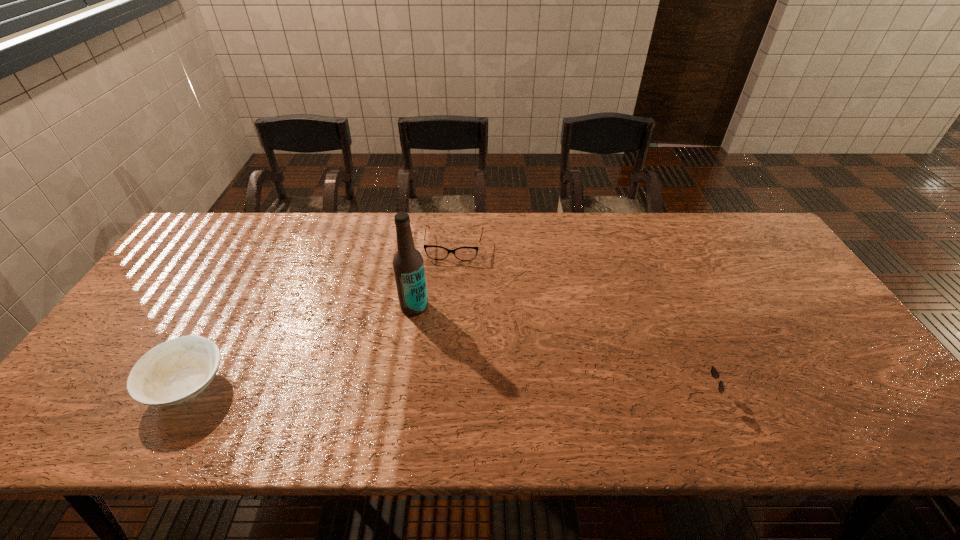
You are a GUI agent. You are given a task and a screenshot of the screen. Output one action in this format:
    pyautogui.click(x=<x>, y=<y>)
    Task: Click on the free space between the tallest object and the sunglasses
    The image size is (960, 540).
    Given the screenshot: What is the action you would take?
    pyautogui.click(x=555, y=350)

Where is `free space between the second farthest object and the rightmost object`? This screenshot has height=540, width=960. free space between the second farthest object and the rightmost object is located at coordinates (555, 350).

At what (x,y) coordinates should I click in order to perform the action: click on vacant space that's between the leftmost object and the farthest object. Please return your answer as a coordinate pair (x, y). The width and height of the screenshot is (960, 540). Looking at the image, I should click on (322, 316).

Where is `vacant point located between the tallest object and the bowl`? This screenshot has width=960, height=540. vacant point located between the tallest object and the bowl is located at coordinates (301, 346).

Identify the location of vacant area that lies between the shortest object and the rightmost object. This screenshot has width=960, height=540. (575, 321).

Find the location of a particular element. This screenshot has width=960, height=540. unoccupied area between the rightmost object and the tallest object is located at coordinates (555, 350).

This screenshot has height=540, width=960. I want to click on free point between the tallest object and the bowl, so click(x=301, y=346).

This screenshot has height=540, width=960. Find the location of `free space that is in between the tallest object and the leftmost object`. free space that is in between the tallest object and the leftmost object is located at coordinates (301, 346).

You are a GUI agent. You are given a task and a screenshot of the screen. Output one action in this format:
    pyautogui.click(x=<x>, y=<y>)
    Task: Click on the free space between the spectacles and the rightmost object
    The image size is (960, 540).
    Given the screenshot: What is the action you would take?
    pyautogui.click(x=575, y=321)

Locate an element on the screen. This screenshot has width=960, height=540. vacant point located between the beer bottle and the rightmost object is located at coordinates (555, 350).